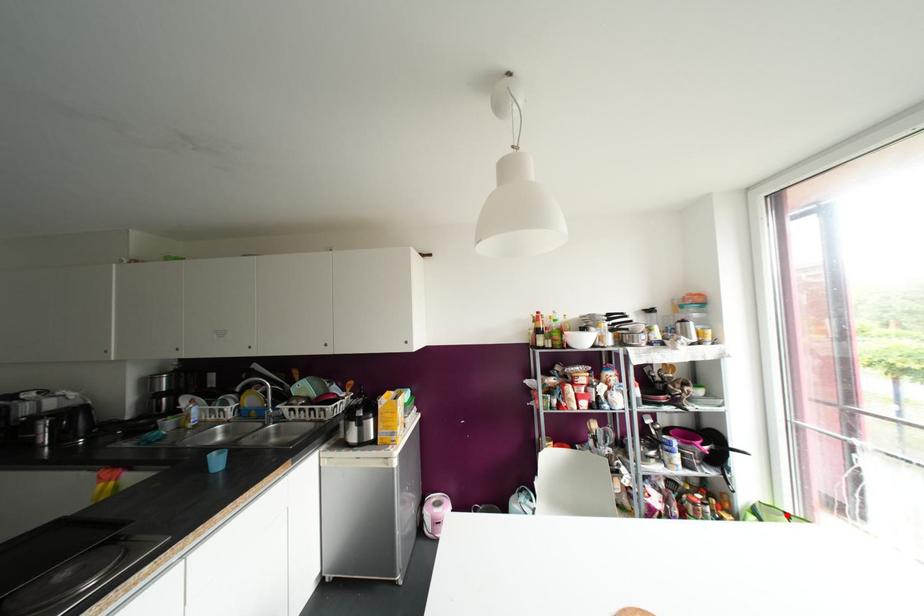
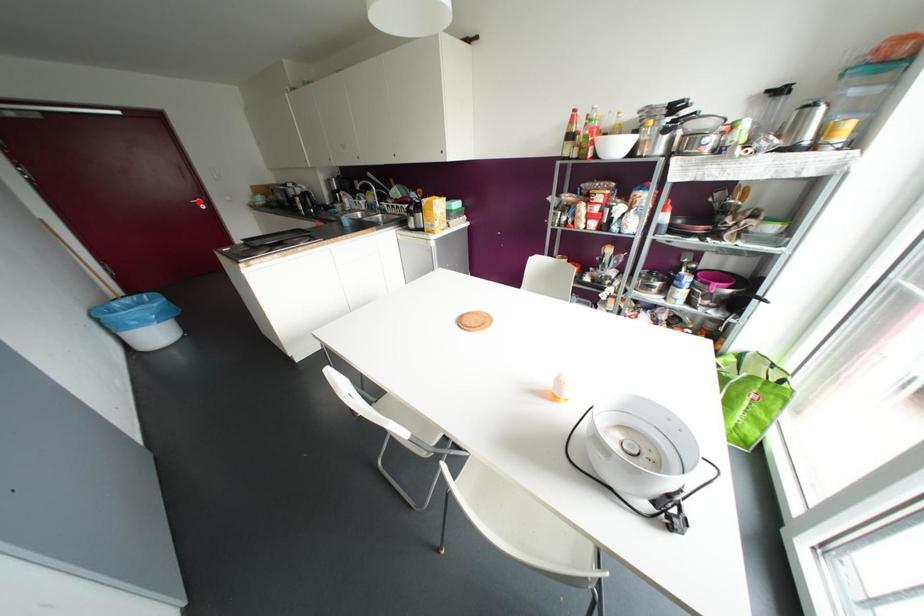
I am providing you with two images of the same scene from different viewpoints. A red point is marked on the first image and another point is marked on the second image. Do the highlighted points in image1 and image2 indicate the same real-world spot?

No